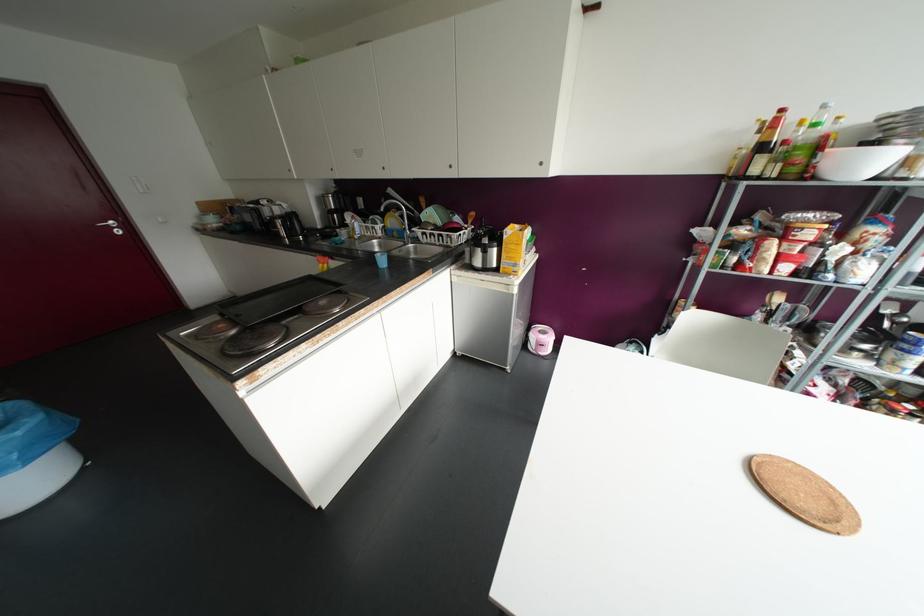
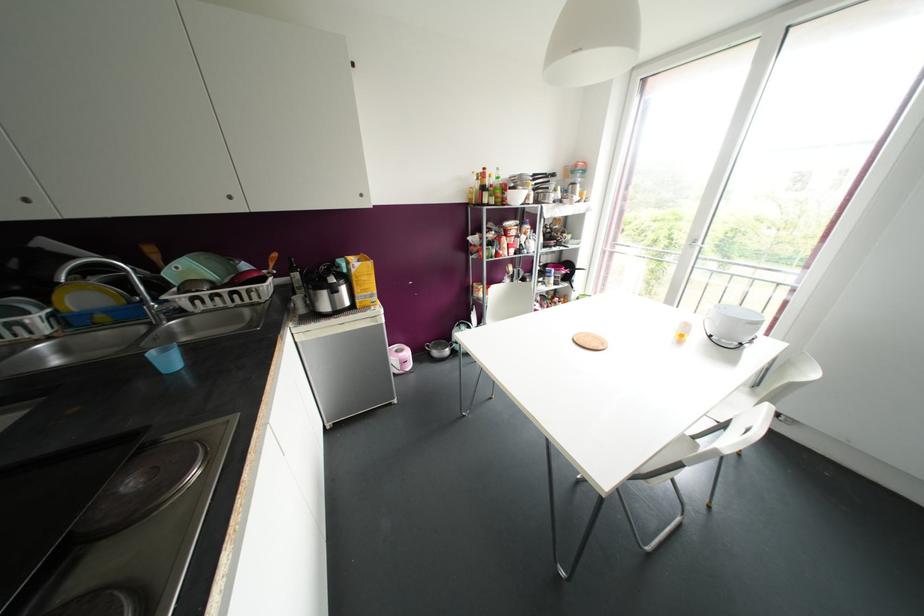
Where in the second image is the point corresponding to point 382,261 from the first image?

(168, 361)